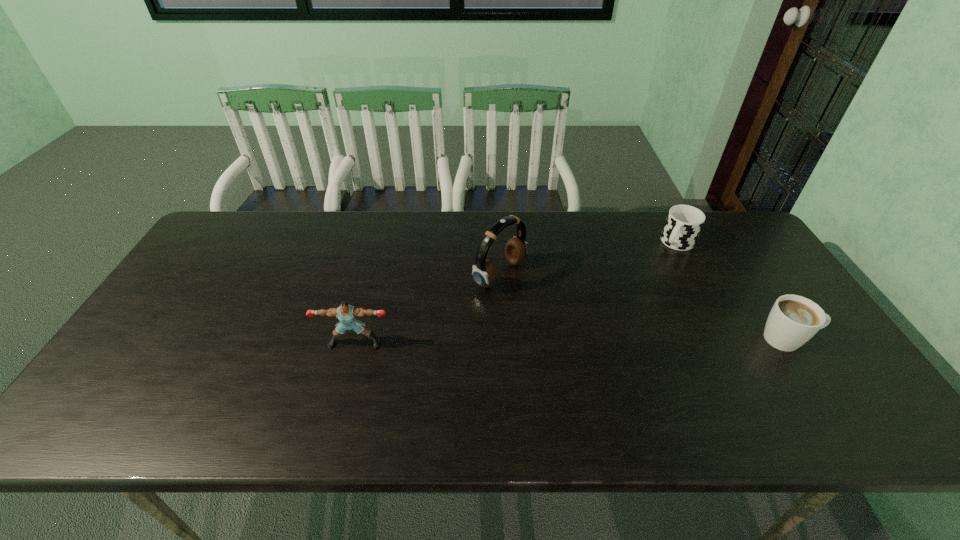
Find the location of a particular element. Image resolution: width=960 pixels, height=540 pixels. free space at the right edge of the desktop is located at coordinates (739, 294).

Image resolution: width=960 pixels, height=540 pixels. I want to click on vacant space at the near right corner of the desktop, so [797, 373].

Image resolution: width=960 pixels, height=540 pixels. I want to click on vacant area that lies between the rightmost object and the third object from right to left, so click(644, 307).

Locate an element on the screen. Image resolution: width=960 pixels, height=540 pixels. free space between the puncher and the second farthest object is located at coordinates (427, 308).

The image size is (960, 540). I want to click on unoccupied position between the rightmost object and the second object from left to right, so click(644, 307).

The width and height of the screenshot is (960, 540). I want to click on vacant area that lies between the farthest object and the second tallest object, so click(x=516, y=293).

Locate an element on the screen. Image resolution: width=960 pixels, height=540 pixels. free spot between the farthest object and the cappuccino is located at coordinates tap(732, 291).

This screenshot has height=540, width=960. In order to click on free spot between the cappuccino and the third shortest object in this screenshot , I will do `click(571, 341)`.

Identify the location of free point between the tallest object and the third shortest object. This screenshot has width=960, height=540. (427, 308).

This screenshot has height=540, width=960. What are the coordinates of `free spot between the third nearest object and the rightmost object` in the screenshot? It's located at (644, 307).